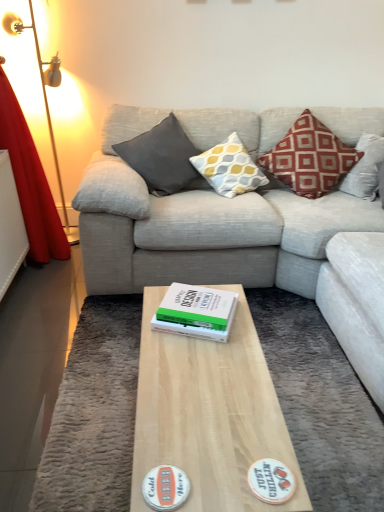
Where is `free area behind white matte sticker at center, the second sticker in the left-to-right sequence`? The image size is (384, 512). free area behind white matte sticker at center, the second sticker in the left-to-right sequence is located at coordinates (248, 421).